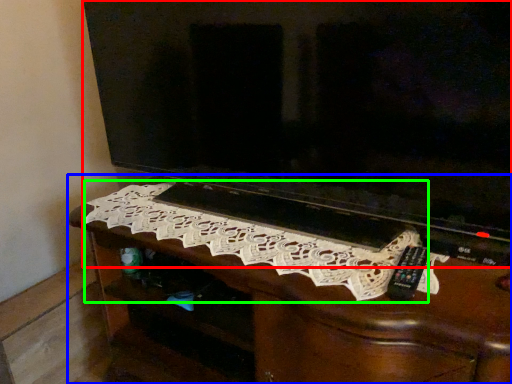
Question: Which object is positioned farthest from television (highlighted by a red box)? Select from furniture (highlighted by a blue box) and embroidery (highlighted by a green box).

Choices:
 (A) furniture
 (B) embroidery

Answer: (A)